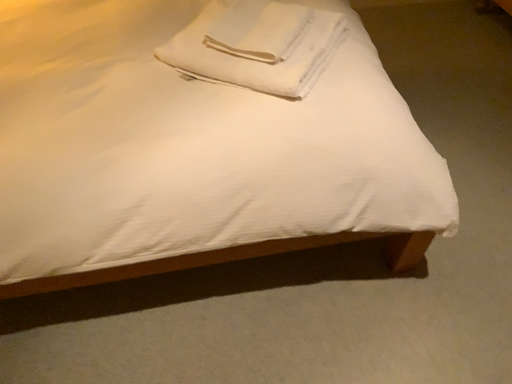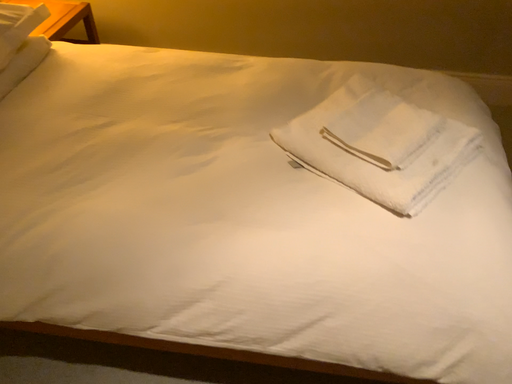
Question: How did the camera likely rotate when shooting the video?

Choices:
 (A) rotated right
 (B) rotated left

Answer: (B)